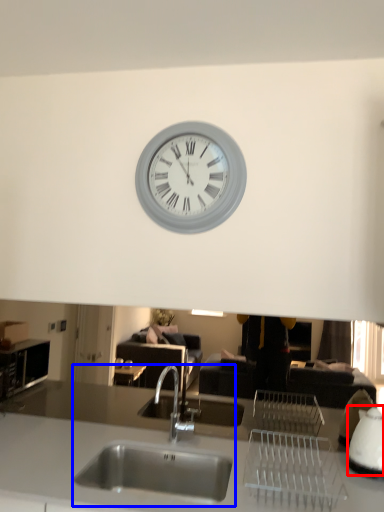
Question: Among these objects, which one is farthest to the camera, appliance (highlighted by a red box) or sink (highlighted by a blue box)?

Choices:
 (A) appliance
 (B) sink

Answer: (A)